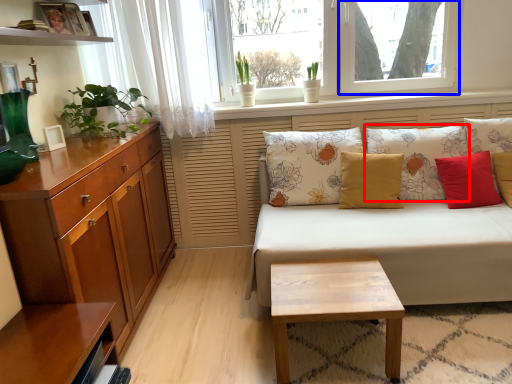
Question: Which point is further to the camera, pillow (highlighted by a red box) or window screen (highlighted by a blue box)?

Choices:
 (A) pillow
 (B) window screen

Answer: (B)